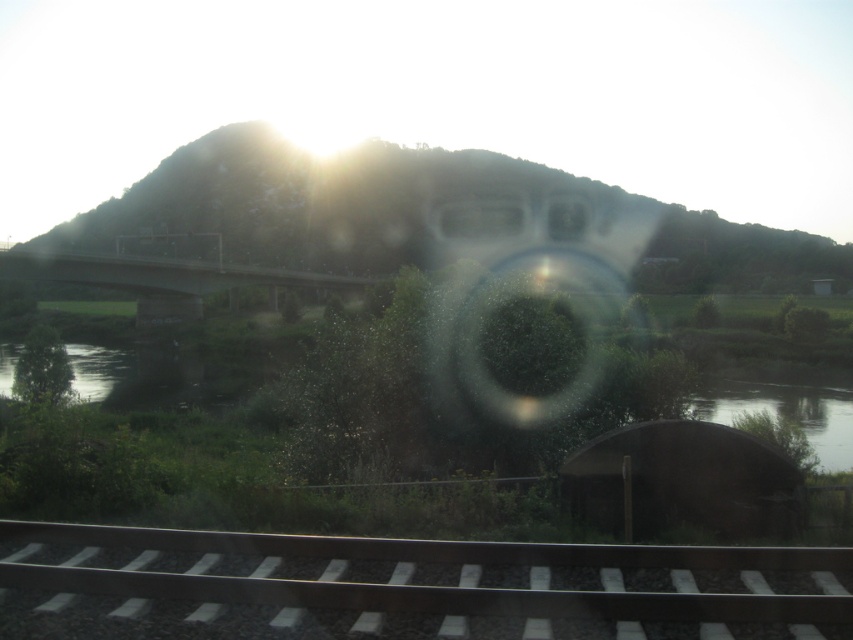
At what (x,y) coordinates should I click in order to perform the action: click on transparent glass lens at center. Please return your answer as a coordinate pair (x, y). The height and width of the screenshot is (640, 853). Looking at the image, I should click on (527, 292).

Does transparent glass lens at center have a greater width compared to green concrete bridge at center?

Yes, transparent glass lens at center is wider than green concrete bridge at center.

Locate an element on the screen. transparent glass lens at center is located at coordinates (527, 292).

Identify the location of transparent glass lens at center. Image resolution: width=853 pixels, height=640 pixels. (527, 292).

Can you confirm if smooth steel tracks at bottom center is positioned to the right of green concrete bridge at center?

Correct, you'll find smooth steel tracks at bottom center to the right of green concrete bridge at center.

Is point (665, 624) positioned behind point (80, 256)?

No, it is not.

Find the location of a particular element. The height and width of the screenshot is (640, 853). smooth steel tracks at bottom center is located at coordinates (407, 586).

Between smooth steel tracks at bottom center and transparent glass lens at center, which one appears on the left side from the viewer's perspective?

From the viewer's perspective, smooth steel tracks at bottom center appears more on the left side.

Can you confirm if smooth steel tracks at bottom center is positioned to the right of transparent glass lens at center?

No, smooth steel tracks at bottom center is not to the right of transparent glass lens at center.

At what (x,y) coordinates should I click in order to perform the action: click on smooth steel tracks at bottom center. Please return your answer as a coordinate pair (x, y). The height and width of the screenshot is (640, 853). Looking at the image, I should click on (407, 586).